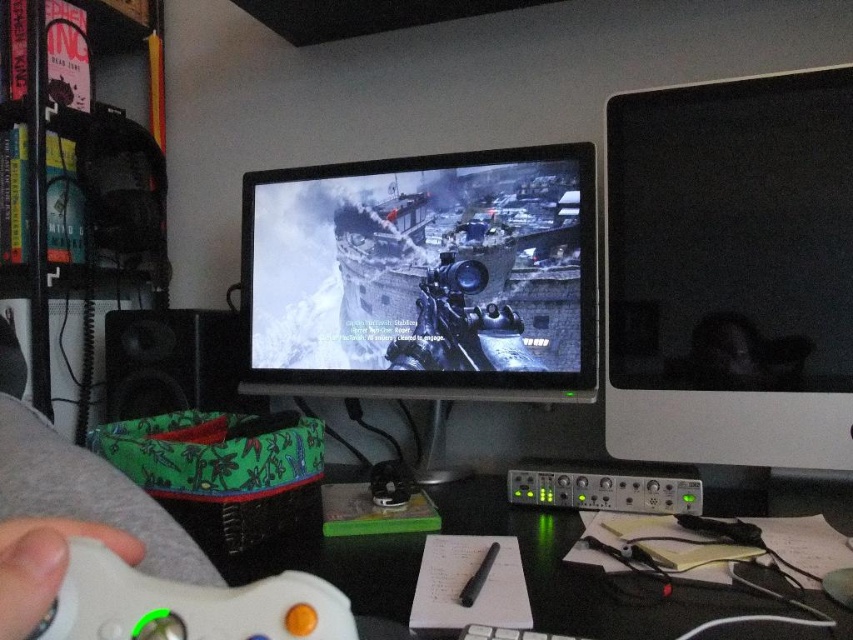
Between white matte game controller at lower left and white matte controller at lower left, which one is positioned lower?

white matte game controller at lower left

Who is higher up, white matte game controller at lower left or white matte controller at lower left?

Positioned higher is white matte controller at lower left.

Describe the element at coordinates (187, 604) in the screenshot. I see `white matte game controller at lower left` at that location.

Locate an element on the screen. This screenshot has height=640, width=853. white matte game controller at lower left is located at coordinates (187, 604).

Which is more to the right, matte black monitor at center or black plastic computer desk at center?

black plastic computer desk at center

Can you confirm if matte black monitor at center is taller than black plastic computer desk at center?

Yes, matte black monitor at center is taller than black plastic computer desk at center.

Is point (519, 172) in front of point (579, 611)?

No.

At what (x,y) coordinates should I click in order to perform the action: click on matte black monitor at center. Please return your answer as a coordinate pair (x, y). Image resolution: width=853 pixels, height=640 pixels. Looking at the image, I should click on [x=422, y=276].

Which is more to the left, black plastic computer desk at center or white matte game controller at lower left?

white matte game controller at lower left

Who is taller, black plastic computer desk at center or white matte game controller at lower left?

black plastic computer desk at center is taller.

The image size is (853, 640). In order to click on black plastic computer desk at center in this screenshot , I will do `click(581, 572)`.